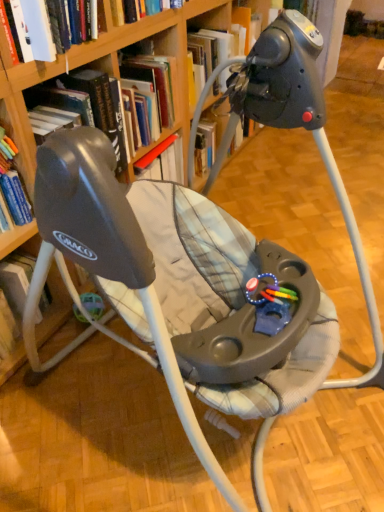
Question: Is hardcover book at upper left, acting as the 1th book starting from the bottom, bigger than hardcover book at upper center, acting as the first book starting from the top?

Choices:
 (A) no
 (B) yes

Answer: (B)

Question: From a real-world perspective, is hardcover book at upper left, acting as the 1th book starting from the bottom, physically above hardcover book at upper center, acting as the first book starting from the top?

Choices:
 (A) yes
 (B) no

Answer: (B)

Question: Is hardcover book at upper left, acting as the 1th book starting from the bottom, next to hardcover book at upper center, which is the 2th book in bottom-to-top order, and touching it?

Choices:
 (A) no
 (B) yes

Answer: (A)

Question: Considering the relative sizes of hardcover book at upper left, acting as the 1th book starting from the bottom, and hardcover book at upper center, which is the 2th book in bottom-to-top order, in the image provided, is hardcover book at upper left, acting as the 1th book starting from the bottom, taller than hardcover book at upper center, which is the 2th book in bottom-to-top order,?

Choices:
 (A) no
 (B) yes

Answer: (B)

Question: Does hardcover book at upper left, acting as the 1th book starting from the bottom, appear on the right side of hardcover book at upper center, which is the 2th book in bottom-to-top order?

Choices:
 (A) yes
 (B) no

Answer: (A)

Question: Does hardcover book at upper left, acting as the 1th book starting from the bottom, turn towards hardcover book at upper center, which is the 2th book in bottom-to-top order?

Choices:
 (A) yes
 (B) no

Answer: (B)

Question: Does rubberized plastic teething toy at center lie behind hardcover book at upper center, which is the 2th book in bottom-to-top order?

Choices:
 (A) yes
 (B) no

Answer: (B)

Question: Would you say rubberized plastic teething toy at center contains hardcover book at upper center, acting as the first book starting from the top?

Choices:
 (A) no
 (B) yes

Answer: (A)

Question: Considering the relative sizes of rubberized plastic teething toy at center and hardcover book at upper center, acting as the first book starting from the top, in the image provided, is rubberized plastic teething toy at center thinner than hardcover book at upper center, acting as the first book starting from the top,?

Choices:
 (A) yes
 (B) no

Answer: (A)

Question: Does rubberized plastic teething toy at center have a greater width compared to hardcover book at upper center, acting as the first book starting from the top?

Choices:
 (A) no
 (B) yes

Answer: (A)

Question: Considering the relative sizes of rubberized plastic teething toy at center and hardcover book at upper center, which is the 2th book in bottom-to-top order, in the image provided, is rubberized plastic teething toy at center bigger than hardcover book at upper center, which is the 2th book in bottom-to-top order,?

Choices:
 (A) no
 (B) yes

Answer: (A)

Question: From a real-world perspective, is rubberized plastic teething toy at center over hardcover book at upper center, which is the 2th book in bottom-to-top order?

Choices:
 (A) yes
 (B) no

Answer: (B)

Question: From the image's perspective, is wooden bookcase at upper center beneath rubberized plastic teething toy at center?

Choices:
 (A) yes
 (B) no

Answer: (B)